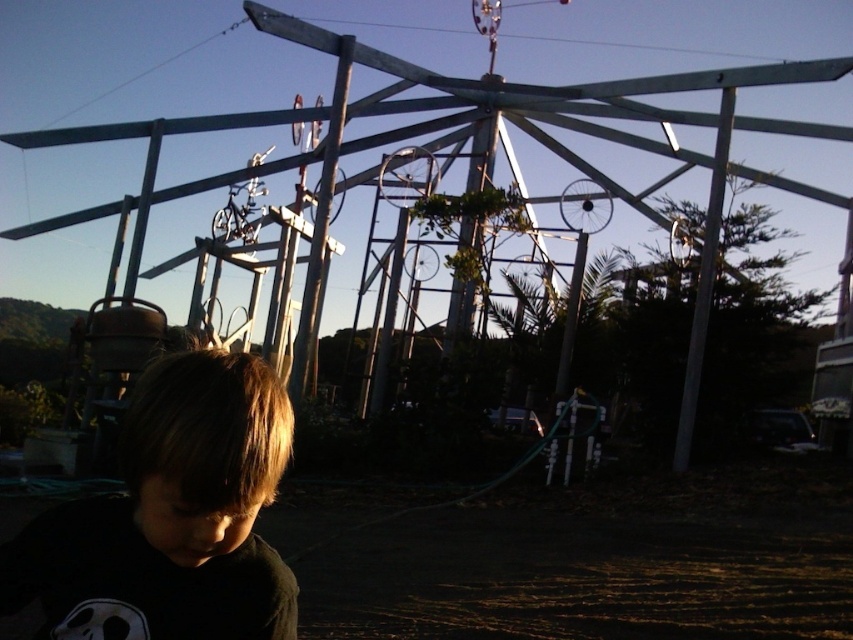
Question: Is dark brown hair at lower left below metallic silver pole at center?

Choices:
 (A) no
 (B) yes

Answer: (B)

Question: Which is nearer to the metallic silver pole at center?

Choices:
 (A) white matte pole at right
 (B) dark brown hair at lower left

Answer: (A)

Question: Which point is farther to the camera?

Choices:
 (A) metallic silver pole at center
 (B) dark brown hair at lower left

Answer: (A)

Question: Estimate the real-world distances between objects in this image. Which object is farther from the dark brown hair at lower left?

Choices:
 (A) metallic silver pole at center
 (B) white matte pole at right

Answer: (B)

Question: Considering the relative positions of metallic silver pole at center and white matte pole at right in the image provided, where is metallic silver pole at center located with respect to white matte pole at right?

Choices:
 (A) below
 (B) above

Answer: (B)

Question: Can you confirm if metallic silver pole at center is positioned to the left of white matte pole at right?

Choices:
 (A) yes
 (B) no

Answer: (A)